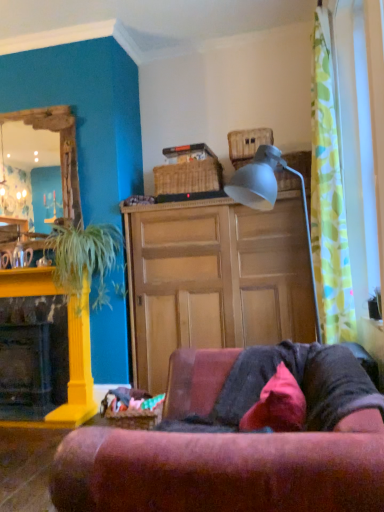
This screenshot has height=512, width=384. What do you see at coordinates (134, 416) in the screenshot?
I see `multicolored woven picnic basket at lower center, the 3th picnic basket in the right-to-left sequence` at bounding box center [134, 416].

The width and height of the screenshot is (384, 512). Describe the element at coordinates (328, 197) in the screenshot. I see `green floral fabric curtain at right` at that location.

How much space does woven brown picnic basket at upper center, which ranks as the first picnic basket in right-to-left order, occupy horizontally?

It is 17.01 inches.

In order to click on green leafy plant at left in this screenshot , I will do `click(84, 258)`.

This screenshot has width=384, height=512. Describe the element at coordinates (188, 177) in the screenshot. I see `woven brown picnic basket at upper center, which is the 2th picnic basket from right to left` at that location.

This screenshot has width=384, height=512. I want to click on wooden cabinet at center, so click(215, 279).

Image resolution: width=384 pixels, height=512 pixels. What do you see at coordinates (73, 373) in the screenshot? I see `yellow painted brick fireplace at left` at bounding box center [73, 373].

The width and height of the screenshot is (384, 512). I want to click on multicolored woven picnic basket at lower center, which is the 3th picnic basket in top-to-bottom order, so click(134, 416).

Which is correct: green floral fabric curtain at right is inside yellow painted brick fireplace at left, or outside of it?

green floral fabric curtain at right exists outside the volume of yellow painted brick fireplace at left.

Does green floral fabric curtain at right lie behind yellow painted brick fireplace at left?

No, green floral fabric curtain at right is in front of yellow painted brick fireplace at left.

Considering the sizes of green floral fabric curtain at right and yellow painted brick fireplace at left in the image, is green floral fabric curtain at right taller or shorter than yellow painted brick fireplace at left?

green floral fabric curtain at right is taller than yellow painted brick fireplace at left.

Considering the points (151, 424) and (172, 270), which point is in front, point (151, 424) or point (172, 270)?

The point (151, 424) is closer.

Looking at this image, from a real-world perspective, between multicolored woven picnic basket at lower center, which is the 3th picnic basket in top-to-bottom order, and wooden cabinet at center, who is vertically higher?

wooden cabinet at center, from a real-world perspective.

Are multicolored woven picnic basket at lower center, positioned as the 1th picnic basket in bottom-to-top order, and wooden cabinet at center far apart?

Yes, multicolored woven picnic basket at lower center, positioned as the 1th picnic basket in bottom-to-top order, and wooden cabinet at center are quite far apart.

Which object is further away from the camera taking this photo, multicolored woven picnic basket at lower center, positioned as the 1th picnic basket in bottom-to-top order, or wooden cabinet at center?

wooden cabinet at center is more distant.

Which of these two, wooden mirror at left or yellow painted brick fireplace at left, is smaller?

wooden mirror at left is smaller.

What's the angular difference between wooden mirror at left and yellow painted brick fireplace at left's facing directions?

0.766 degrees separate the facing orientations of wooden mirror at left and yellow painted brick fireplace at left.

Looking at this image, how much distance is there between wooden mirror at left and yellow painted brick fireplace at left?

wooden mirror at left is 1.00 meters away from yellow painted brick fireplace at left.

From the picture: Is wooden mirror at left spatially inside yellow painted brick fireplace at left, or outside of it?

wooden mirror at left cannot be found inside yellow painted brick fireplace at left.

Can velvet pink pillow at lower center be found inside wooden mirror at left?

No.

Consider the image. Is wooden mirror at left at the right side of velvet pink pillow at lower center?

Incorrect, wooden mirror at left is not on the right side of velvet pink pillow at lower center.

How much distance is there between wooden mirror at left and velvet pink pillow at lower center?

2.41 meters.

Which is more to the left, woven brown picnic basket at upper center, marked as the second picnic basket in a top-to-bottom arrangement, or green floral fabric curtain at right?

From the viewer's perspective, woven brown picnic basket at upper center, marked as the second picnic basket in a top-to-bottom arrangement, appears more on the left side.

Which point is more distant from viewer, (221, 183) or (311, 105)?

The point (221, 183) is more distant.

Does woven brown picnic basket at upper center, which is the 2th picnic basket from right to left, turn towards green floral fabric curtain at right?

No, woven brown picnic basket at upper center, which is the 2th picnic basket from right to left, does not turn towards green floral fabric curtain at right.

From the picture: From a real-world perspective, is velvet pink pillow at lower center physically below yellow painted brick fireplace at left?

Yes, from a real-world perspective, velvet pink pillow at lower center is under yellow painted brick fireplace at left.

Is velvet pink pillow at lower center inside the boundaries of yellow painted brick fireplace at left, or outside?

velvet pink pillow at lower center is spatially situated outside yellow painted brick fireplace at left.

How far apart are velvet pink pillow at lower center and yellow painted brick fireplace at left?

velvet pink pillow at lower center is 1.87 meters from yellow painted brick fireplace at left.

From the image's perspective, is velvet pink pillow at lower center above yellow painted brick fireplace at left?

No, from the image's perspective, velvet pink pillow at lower center is not on top of yellow painted brick fireplace at left.

Relative to velvet red couch at center, is multicolored woven picnic basket at lower center, which is the 3th picnic basket in top-to-bottom order, in front or behind?

Visually, multicolored woven picnic basket at lower center, which is the 3th picnic basket in top-to-bottom order, is located behind velvet red couch at center.

From a real-world perspective, which is physically below, multicolored woven picnic basket at lower center, which is the 3th picnic basket in top-to-bottom order, or velvet red couch at center?

multicolored woven picnic basket at lower center, which is the 3th picnic basket in top-to-bottom order, from a real-world perspective.

Between multicolored woven picnic basket at lower center, which is the 3th picnic basket in top-to-bottom order, and velvet red couch at center, which one has larger size?

Bigger between the two is velvet red couch at center.

Find the location of a particular element. This screenshot has width=384, height=512. fireplace located underneath the green floral fabric curtain at right (from a real-world perspective) is located at coordinates (73, 373).

The height and width of the screenshot is (512, 384). In the image, there is a multicolored woven picnic basket at lower center, the 3th picnic basket in the right-to-left sequence. What are the coordinates of `cabinetry above it (from the image's perspective)` in the screenshot? It's located at (215, 279).

Considering their positions, is wooden mirror at left positioned closer to yellow painted brick fireplace at left than wooden cabinet at center?

wooden cabinet at center is positioned closer to the anchor yellow painted brick fireplace at left.

When comparing their distances from green leafy plant at left, does multicolored woven picnic basket at lower center, positioned as the 1th picnic basket in bottom-to-top order, or velvet pink pillow at lower center seem closer?

The object closer to green leafy plant at left is multicolored woven picnic basket at lower center, positioned as the 1th picnic basket in bottom-to-top order.

From the image, which object appears to be farther from woven brown picnic basket at upper center, which ranks as the first picnic basket in right-to-left order, green leafy plant at left or wooden mirror at left?

wooden mirror at left is further to woven brown picnic basket at upper center, which ranks as the first picnic basket in right-to-left order.

Estimate the real-world distances between objects in this image. Which object is closer to velvet pink pillow at lower center, woven brown picnic basket at upper center, marked as the second picnic basket in a top-to-bottom arrangement, or yellow painted brick fireplace at left?

The object closer to velvet pink pillow at lower center is yellow painted brick fireplace at left.

Looking at the image, which one is located further to wooden mirror at left, velvet red couch at center or multicolored woven picnic basket at lower center, which is counted as the 1th picnic basket, starting from the left?

velvet red couch at center.

From the image, which object appears to be nearer to green leafy plant at left, green floral fabric curtain at right or wooden cabinet at center?

wooden cabinet at center.

Considering their positions, is woven brown picnic basket at upper center, placed as the third picnic basket when sorted from bottom to top, positioned closer to green leafy plant at left than multicolored woven picnic basket at lower center, the 3th picnic basket in the right-to-left sequence?

Among the two, multicolored woven picnic basket at lower center, the 3th picnic basket in the right-to-left sequence, is located nearer to green leafy plant at left.

Based on their spatial positions, is wooden mirror at left or velvet red couch at center closer to wooden cabinet at center?

Based on the image, wooden mirror at left appears to be nearer to wooden cabinet at center.

You are a GUI agent. You are given a task and a screenshot of the screen. Output one action in this format:
    pyautogui.click(x=<x>, y=<y>)
    Task: Click on the mirror between woven brown picnic basket at upper center, placed as the third picnic basket when sorted from bottom to top, and multicolored woven picnic basket at lower center, the 3th picnic basket in the right-to-left sequence, vertically
    
    Given the screenshot: What is the action you would take?
    pyautogui.click(x=60, y=150)

You are a GUI agent. You are given a task and a screenshot of the screen. Output one action in this format:
    pyautogui.click(x=<x>, y=<y>)
    Task: Click on the houseplant between yellow painted brick fireplace at left and wooden cabinet at center from left to right
    This screenshot has height=512, width=384.
    Given the screenshot: What is the action you would take?
    pyautogui.click(x=84, y=258)

Locate an element on the screen. This screenshot has height=512, width=384. houseplant between wooden mirror at left and yellow painted brick fireplace at left in the vertical direction is located at coordinates (84, 258).

Locate an element on the screen. lamp between wooden mirror at left and multicolored woven picnic basket at lower center, which is counted as the 1th picnic basket, starting from the left, in the vertical direction is located at coordinates (270, 195).